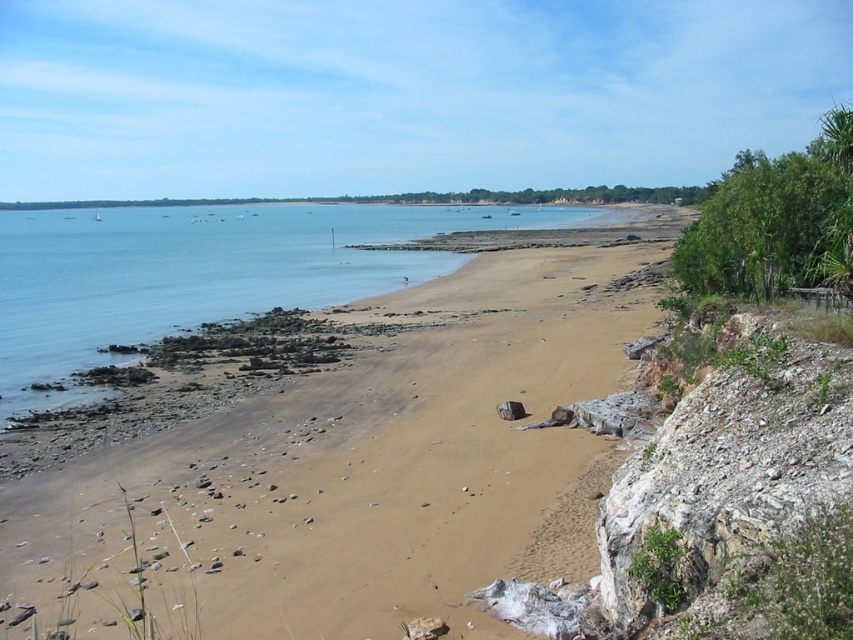
Is point (170, 404) farther from camera compared to point (413, 228)?

No.

Does brown sand at center have a larger size compared to blue water at center?

Actually, brown sand at center might be smaller than blue water at center.

Find the location of `brown sand at center`. brown sand at center is located at coordinates (329, 456).